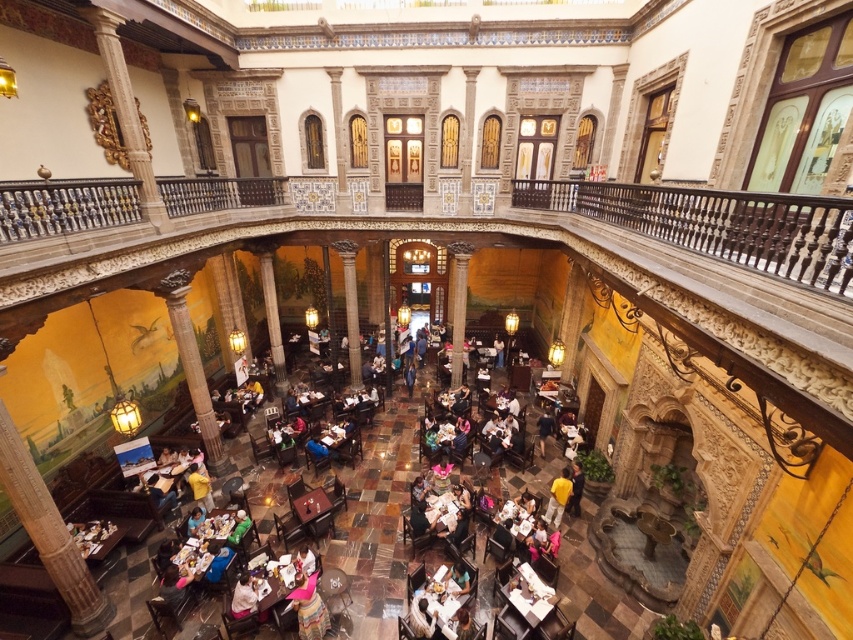
Question: Does wooden table at center have a lesser width compared to yellow matte shirt at center?

Choices:
 (A) no
 (B) yes

Answer: (A)

Question: From the image, what is the correct spatial relationship of yellow fabric at lower center in relation to green fabric person at center?

Choices:
 (A) right
 (B) left

Answer: (A)

Question: Which of the following is the farthest from the observer?

Choices:
 (A) pink fabric at lower center
 (B) dark blue shirt at center
 (C) white fabric shirt at lower center

Answer: (B)

Question: Observing the image, what is the correct spatial positioning of pink fabric at lower center in reference to wooden table at lower left?

Choices:
 (A) left
 (B) right

Answer: (B)

Question: Which point is closer to the camera?

Choices:
 (A) (248, 516)
 (B) (234, 595)
 (C) (109, 522)
 (D) (299, 620)

Answer: (D)

Question: Which object is the farthest from the yellow fabric shirt at lower center?

Choices:
 (A) yellow fabric at lower center
 (B) pink fabric at lower center

Answer: (A)